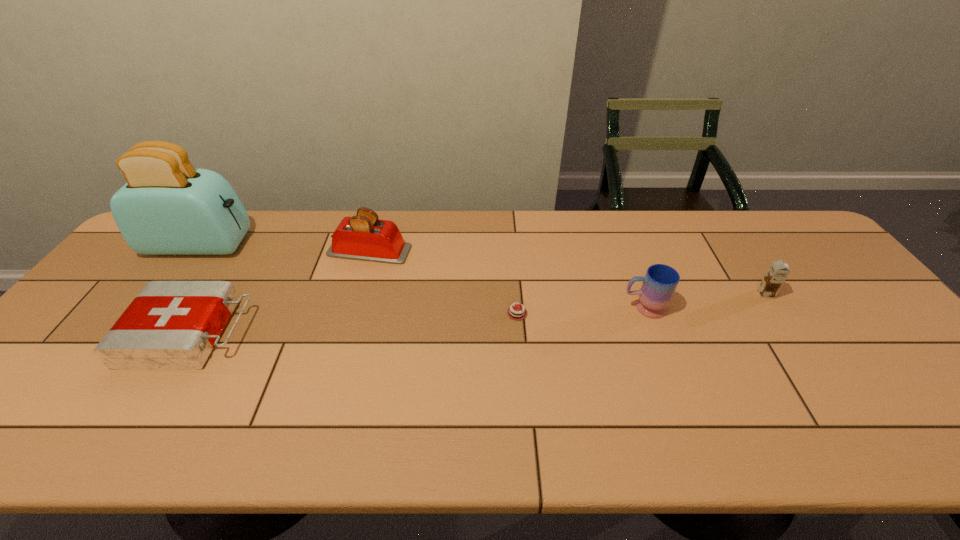
Locate an element on the screen. Image resolution: width=960 pixels, height=540 pixels. vacant area that lies between the chocolate cake and the right toaster is located at coordinates (444, 282).

Identify the location of vacant area that lies between the third object from left to right and the shortest object. The width and height of the screenshot is (960, 540). (444, 282).

At what (x,y) coordinates should I click in order to perform the action: click on vacant space in between the fifth object from left to right and the chocolate milk. Please return your answer as a coordinate pair (x, y). The height and width of the screenshot is (540, 960). Looking at the image, I should click on coord(705,301).

At what (x,y) coordinates should I click in order to perform the action: click on object that is the third nearest to the fifth tallest object. Please return your answer as a coordinate pair (x, y). Looking at the image, I should click on (515, 313).

Where is `the closest object to the chocolate milk`? the closest object to the chocolate milk is located at coordinates (660, 282).

You are a GUI agent. You are given a task and a screenshot of the screen. Output one action in this format:
    pyautogui.click(x=<x>, y=<y>)
    Task: Click on the vacant point that satisfies the following two spatial constraints: 1. on the side of the taller toaster with the lever; 2. on the right side of the shortest object
    Image resolution: width=960 pixels, height=540 pixels.
    Given the screenshot: What is the action you would take?
    [x=150, y=313]

This screenshot has height=540, width=960. In order to click on vacant space that satisfies the following two spatial constraints: 1. on the side of the fifth shortest object with the lever; 2. on the left side of the tallest object in this screenshot , I will do `click(196, 251)`.

Find the location of a particular element. The image size is (960, 540). free location that satisfies the following two spatial constraints: 1. on the side of the mug with the handle; 2. on the front side of the shortest object is located at coordinates (646, 313).

This screenshot has width=960, height=540. In order to click on vacant space that satisfies the following two spatial constraints: 1. on the front side of the chocolate cake; 2. on the right side of the third object from left to right in this screenshot , I will do `click(351, 313)`.

The height and width of the screenshot is (540, 960). Identify the location of free space that satisfies the following two spatial constraints: 1. on the side of the taller toaster with the lever; 2. on the back side of the third object from right to left. (150, 313).